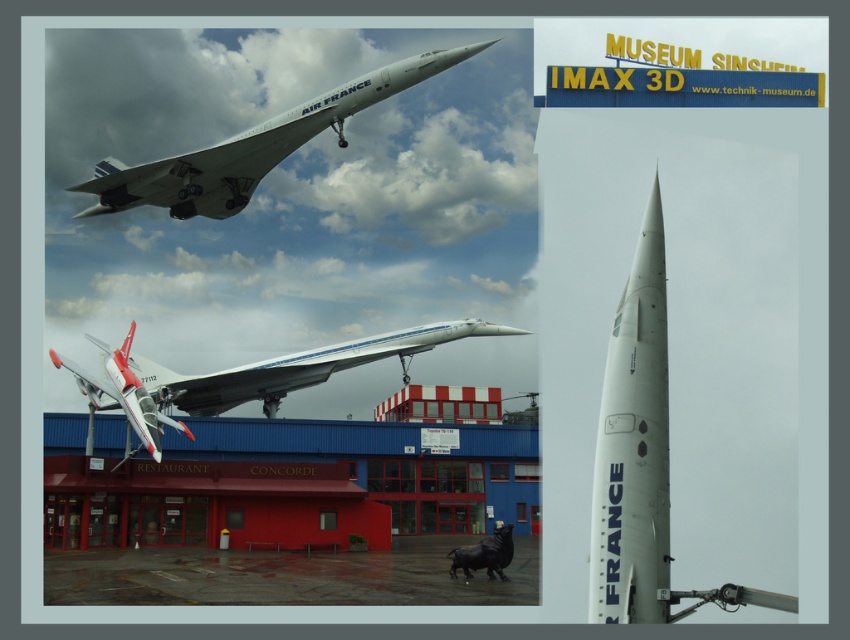
Can you confirm if white matte concorde at center is taller than white glossy airplane at upper center?

Yes, white matte concorde at center is taller than white glossy airplane at upper center.

You are a GUI agent. You are given a task and a screenshot of the screen. Output one action in this format:
    pyautogui.click(x=<x>, y=<y>)
    Task: Click on the white matte concorde at center
    
    Given the screenshot: What is the action you would take?
    pyautogui.click(x=633, y=445)

Measure the distance from white matte concorde at center to white glossy airplane at center.

They are 164.10 feet apart.

Does white matte concorde at center have a lesser height compared to white glossy airplane at center?

No.

This screenshot has width=850, height=640. What do you see at coordinates (633, 445) in the screenshot? I see `white matte concorde at center` at bounding box center [633, 445].

This screenshot has height=640, width=850. In order to click on white matte concorde at center in this screenshot , I will do `click(633, 445)`.

Is red matte building at center in front of white glossy airplane at center?

No, it is not.

Does red matte building at center have a smaller size compared to white glossy airplane at center?

Yes.

Where is `red matte building at center`? red matte building at center is located at coordinates (372, 467).